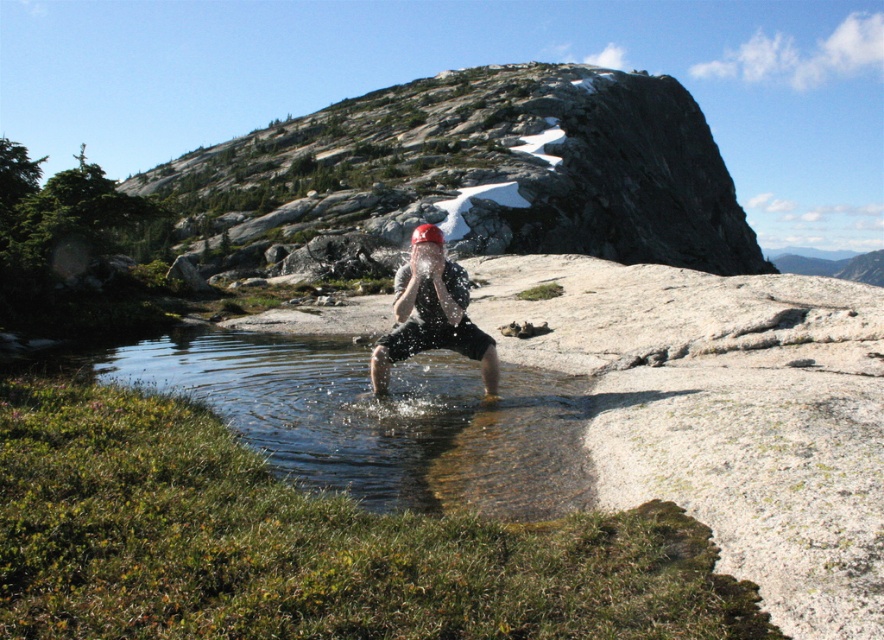
You are a hiker who wants to fill your water bottle from the clear water at center. However, you have a matte black helmet at center. Can you use the helmet to scoop water without getting your hands wet?

The clear water at center is located below the matte black helmet at center, so you can lower the matte black helmet at center into the clear water at center to scoop water without getting your hands wet.

You are a photographer trying to capture the clear water at center and the matte black helmet at center in a single frame. Based on their sizes, which object will appear larger in your photo?

The clear water at center will appear larger in the photo because its width is larger than the matte black helmet at center.

You are a hiker who just arrived at the mountain area. You see a clear water at center located at point (380, 419). Can you confirm if this point is within the splashing area of the person in the image?

The clear water at center is located at point (380, 419), which is the exact location of the splashing area created by the person in the image. Therefore, yes, the point is within the splashing area.